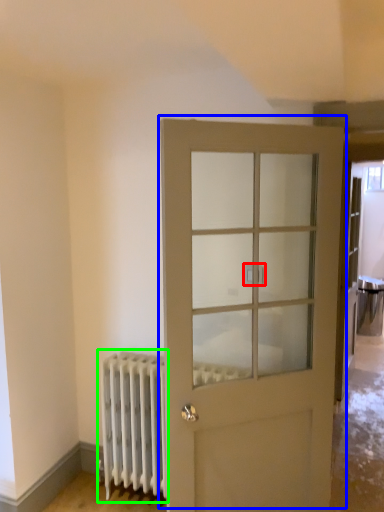
Question: Considering the real-world distances, which object is farthest from door handle (highlighted by a red box)? door (highlighted by a blue box) or radiator (highlighted by a green box)?

Choices:
 (A) door
 (B) radiator

Answer: (B)